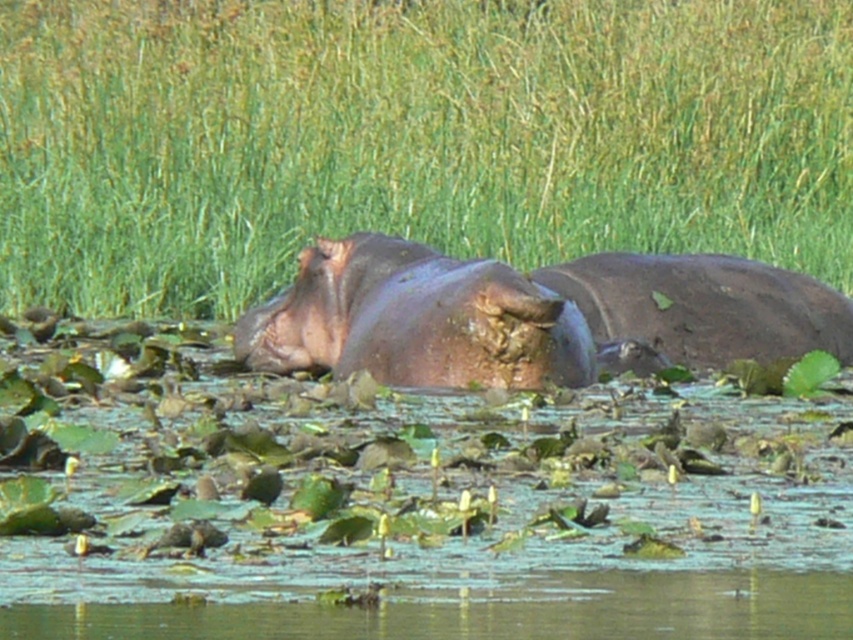
What is the 2D coordinate of the clear water at lower center in the image?

The clear water at lower center is located at the 2D coordinate point of (490, 611).

You are a small frog trying to jump from a rock to the brown matte hippo at center. There is clear water at lower center between you and the hippo. Can you safely land on the hippo without getting wet?

The clear water at lower center is in front of the brown matte hippo at center, so the frog can jump over the clear water at lower center and land safely on the brown matte hippo at center.

You are a wildlife photographer aiming to capture both the muddy skin hippo at center and the brown matte hippo at center in a single frame. Given their sizes, which hippo would require you to adjust your camera position to include its entire body in the photo?

The brown matte hippo at center has a greater width than the muddy skin hippo at center, so you would need to adjust your camera position to include its entire body in the photo.